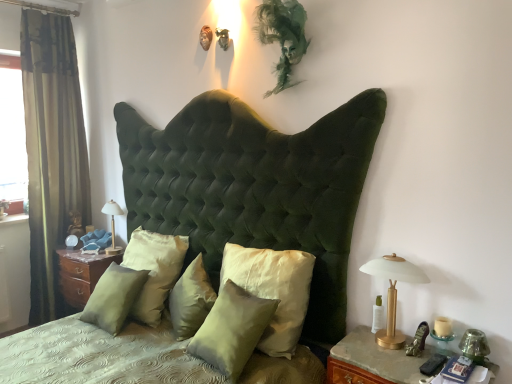
The height and width of the screenshot is (384, 512). Find the location of `empty space that is ontop of wooden nightstand at lower right, the 2th nightstand when ordered from back to front (from a real-world perspective)`. empty space that is ontop of wooden nightstand at lower right, the 2th nightstand when ordered from back to front (from a real-world perspective) is located at coordinates (403, 360).